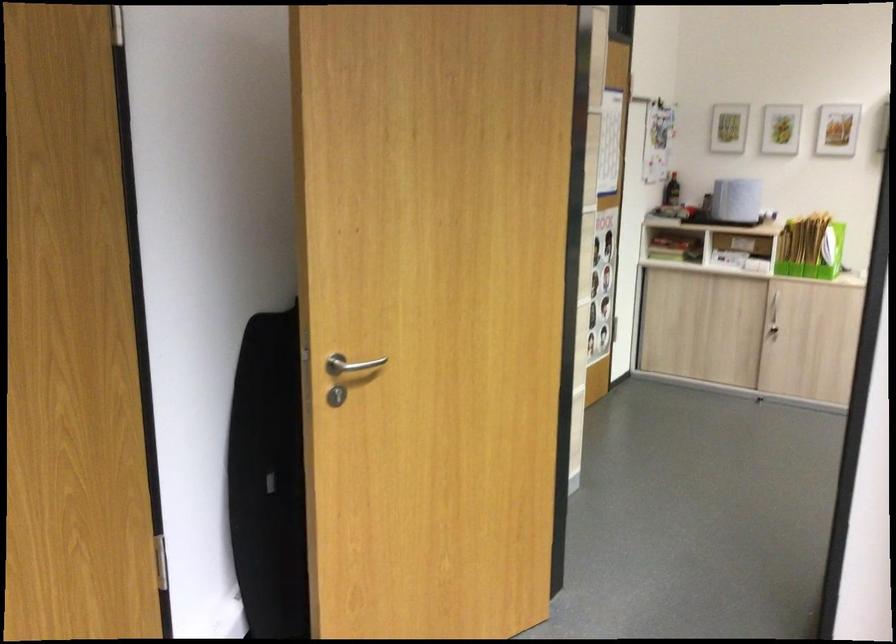
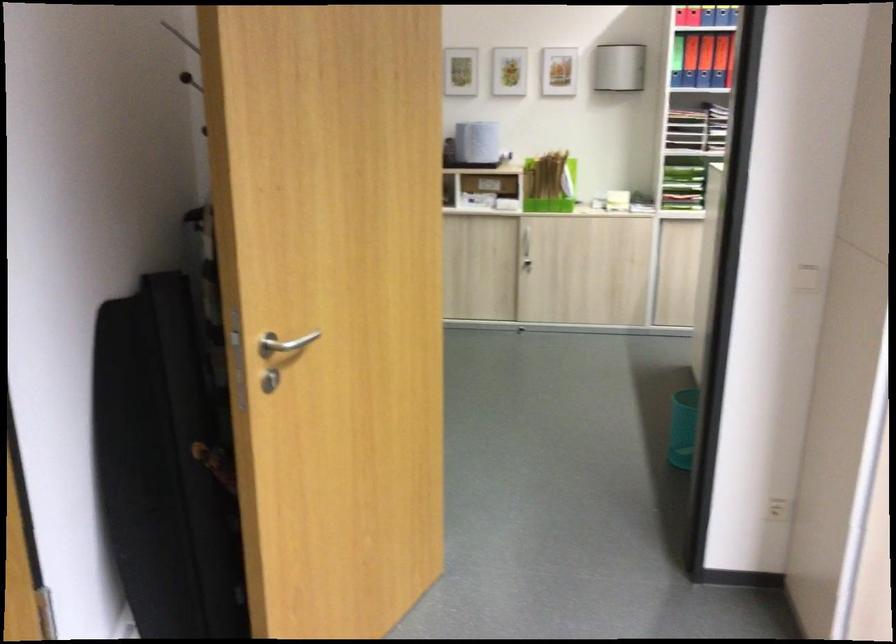
What movement of the cameraman would produce the second image?

The cameraman moved toward left, forward.